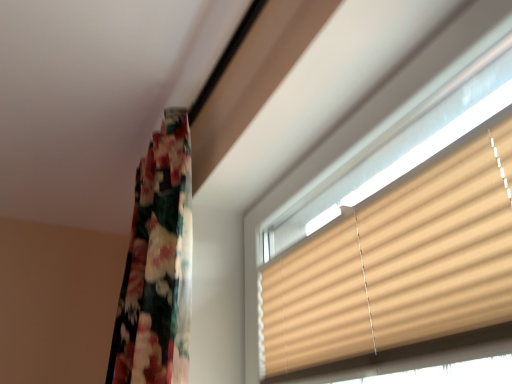
You are a GUI agent. You are given a task and a screenshot of the screen. Output one action in this format:
    pyautogui.click(x=<x>, y=<y>)
    Task: Click on the beige fabric blinds at upper right
    Image resolution: width=512 pixels, height=384 pixels.
    Given the screenshot: What is the action you would take?
    pyautogui.click(x=399, y=269)

The width and height of the screenshot is (512, 384). What do you see at coordinates (399, 269) in the screenshot?
I see `beige fabric blinds at upper right` at bounding box center [399, 269].

Where is `beige fabric blinds at upper right`? This screenshot has width=512, height=384. beige fabric blinds at upper right is located at coordinates (399, 269).